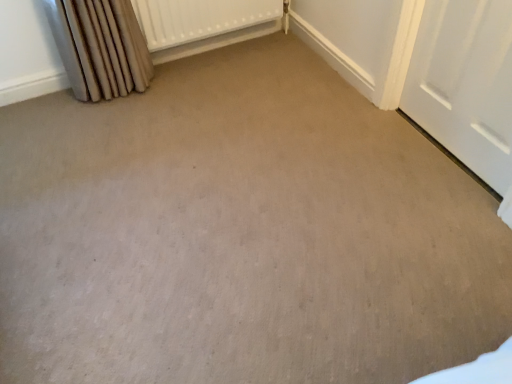
Question: Considering the relative sizes of white textured radiator at upper center and beige fabric curtain at left in the image provided, is white textured radiator at upper center smaller than beige fabric curtain at left?

Choices:
 (A) yes
 (B) no

Answer: (A)

Question: Is white textured radiator at upper center with beige fabric curtain at left?

Choices:
 (A) yes
 (B) no

Answer: (B)

Question: Can you confirm if white textured radiator at upper center is positioned to the left of beige fabric curtain at left?

Choices:
 (A) no
 (B) yes

Answer: (A)

Question: Is white textured radiator at upper center to the right of beige fabric curtain at left from the viewer's perspective?

Choices:
 (A) no
 (B) yes

Answer: (B)

Question: From a real-world perspective, is white textured radiator at upper center physically below beige fabric curtain at left?

Choices:
 (A) yes
 (B) no

Answer: (A)

Question: Is white textured radiator at upper center oriented towards beige fabric curtain at left?

Choices:
 (A) yes
 (B) no

Answer: (B)

Question: Is white textured radiator at upper center bigger than white matte door at right?

Choices:
 (A) no
 (B) yes

Answer: (B)

Question: Are white textured radiator at upper center and white matte door at right located far from each other?

Choices:
 (A) yes
 (B) no

Answer: (A)

Question: Considering the relative positions of white textured radiator at upper center and white matte door at right in the image provided, is white textured radiator at upper center behind white matte door at right?

Choices:
 (A) yes
 (B) no

Answer: (A)

Question: Is white matte door at right surrounded by white textured radiator at upper center?

Choices:
 (A) no
 (B) yes

Answer: (A)

Question: Does white textured radiator at upper center appear on the left side of white matte door at right?

Choices:
 (A) yes
 (B) no

Answer: (A)

Question: Does white textured radiator at upper center have a lesser width compared to white matte door at right?

Choices:
 (A) yes
 (B) no

Answer: (B)

Question: Is white matte door at right not within beige fabric curtain at left?

Choices:
 (A) yes
 (B) no

Answer: (A)